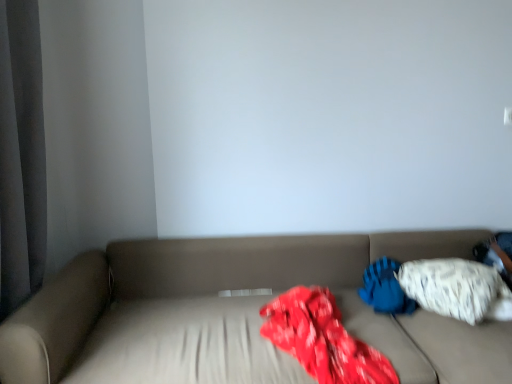
Measure the distance between point (x=75, y=328) and camera.

Point (x=75, y=328) is 1.70 meters from camera.

This screenshot has height=384, width=512. In order to click on white soft pillow at right, marked as the 2th pillow in a right-to-left arrangement in this screenshot , I will do `click(385, 288)`.

This screenshot has height=384, width=512. Identify the location of white textured pillow at right, placed as the first pillow when sorted from right to left. (457, 289).

Is white soft pillow at right, acting as the first pillow starting from the left, positioned with its back to white textured pillow at right, placed as the first pillow when sorted from right to left?

Yes, white textured pillow at right, placed as the first pillow when sorted from right to left, is at the back of white soft pillow at right, acting as the first pillow starting from the left.

Is white soft pillow at right, acting as the first pillow starting from the left, positioned far away from white textured pillow at right, placed as the second pillow when sorted from left to right?

Actually, white soft pillow at right, acting as the first pillow starting from the left, and white textured pillow at right, placed as the second pillow when sorted from left to right, are a little close together.

Which of these two, white soft pillow at right, marked as the 2th pillow in a right-to-left arrangement, or white textured pillow at right, placed as the second pillow when sorted from left to right, stands taller?

Standing taller between the two is white textured pillow at right, placed as the second pillow when sorted from left to right.

Is white textured pillow at right, placed as the first pillow when sorted from right to left, directly adjacent to beige fabric couch at center?

No, white textured pillow at right, placed as the first pillow when sorted from right to left, is not beside beige fabric couch at center.

Is white textured pillow at right, placed as the second pillow when sorted from left to right, facing away from beige fabric couch at center?

No, white textured pillow at right, placed as the second pillow when sorted from left to right, is not facing the opposite direction of beige fabric couch at center.

Considering the sizes of objects white textured pillow at right, placed as the first pillow when sorted from right to left, and beige fabric couch at center in the image provided, who is smaller, white textured pillow at right, placed as the first pillow when sorted from right to left, or beige fabric couch at center?

With smaller size is white textured pillow at right, placed as the first pillow when sorted from right to left.

From the picture: Considering the relative sizes of beige fabric couch at center and white soft pillow at right, marked as the 2th pillow in a right-to-left arrangement, in the image provided, is beige fabric couch at center smaller than white soft pillow at right, marked as the 2th pillow in a right-to-left arrangement,?

No, beige fabric couch at center is not smaller than white soft pillow at right, marked as the 2th pillow in a right-to-left arrangement.

Would you say beige fabric couch at center is outside white soft pillow at right, acting as the first pillow starting from the left?

Yes, beige fabric couch at center is outside of white soft pillow at right, acting as the first pillow starting from the left.

Which is farther from the camera, (55, 342) or (388, 266)?

The point (388, 266) is more distant.

Locate an element on the screen. The width and height of the screenshot is (512, 384). studio couch below the white textured pillow at right, placed as the first pillow when sorted from right to left (from the image's perspective) is located at coordinates (234, 313).

Between beige fabric couch at center and white textured pillow at right, placed as the first pillow when sorted from right to left, which one has larger size?

beige fabric couch at center.

Would you consider beige fabric couch at center to be distant from white textured pillow at right, placed as the second pillow when sorted from left to right?

No, beige fabric couch at center is in close proximity to white textured pillow at right, placed as the second pillow when sorted from left to right.

Which object is more forward, beige fabric couch at center or white textured pillow at right, placed as the first pillow when sorted from right to left?

Positioned in front is beige fabric couch at center.

Would you say white soft pillow at right, acting as the first pillow starting from the left, contains beige fabric couch at center?

No, beige fabric couch at center is not inside white soft pillow at right, acting as the first pillow starting from the left.

From the image's perspective, which is above, white soft pillow at right, marked as the 2th pillow in a right-to-left arrangement, or beige fabric couch at center?

white soft pillow at right, marked as the 2th pillow in a right-to-left arrangement, from the image's perspective.

In terms of width, does white soft pillow at right, acting as the first pillow starting from the left, look wider or thinner when compared to beige fabric couch at center?

Clearly, white soft pillow at right, acting as the first pillow starting from the left, has less width compared to beige fabric couch at center.

Who is bigger, white soft pillow at right, marked as the 2th pillow in a right-to-left arrangement, or beige fabric couch at center?

With larger size is beige fabric couch at center.

How much distance is there between white textured pillow at right, placed as the first pillow when sorted from right to left, and white soft pillow at right, acting as the first pillow starting from the left?

white textured pillow at right, placed as the first pillow when sorted from right to left, and white soft pillow at right, acting as the first pillow starting from the left, are 7.01 inches apart from each other.

Consider the image. Is white textured pillow at right, placed as the second pillow when sorted from left to right, positioned with its back to white soft pillow at right, acting as the first pillow starting from the left?

Absolutely, white textured pillow at right, placed as the second pillow when sorted from left to right, is directed away from white soft pillow at right, acting as the first pillow starting from the left.

Considering the points (414, 278) and (390, 259), which point is in front, point (414, 278) or point (390, 259)?

The point (414, 278) is closer.

Does white textured pillow at right, placed as the second pillow when sorted from left to right, have a lesser height compared to white soft pillow at right, marked as the 2th pillow in a right-to-left arrangement?

In fact, white textured pillow at right, placed as the second pillow when sorted from left to right, may be taller than white soft pillow at right, marked as the 2th pillow in a right-to-left arrangement.

This screenshot has width=512, height=384. I want to click on pillow below the white textured pillow at right, placed as the second pillow when sorted from left to right (from the image's perspective), so click(x=385, y=288).

From the image's perspective, count 2nd pillows upward from the beige fabric couch at center and point to it. Please provide its 2D coordinates.

[(457, 289)]

Looking at the image, which one is located further to white textured pillow at right, placed as the second pillow when sorted from left to right, beige fabric couch at center or white soft pillow at right, marked as the 2th pillow in a right-to-left arrangement?

beige fabric couch at center is further to white textured pillow at right, placed as the second pillow when sorted from left to right.

Based on their spatial positions, is white textured pillow at right, placed as the second pillow when sorted from left to right, or beige fabric couch at center closer to white soft pillow at right, marked as the 2th pillow in a right-to-left arrangement?

Among the two, white textured pillow at right, placed as the second pillow when sorted from left to right, is located nearer to white soft pillow at right, marked as the 2th pillow in a right-to-left arrangement.

Based on their spatial positions, is beige fabric couch at center or white textured pillow at right, placed as the second pillow when sorted from left to right, further from white soft pillow at right, marked as the 2th pillow in a right-to-left arrangement?

beige fabric couch at center is positioned further to the anchor white soft pillow at right, marked as the 2th pillow in a right-to-left arrangement.

Estimate the real-world distances between objects in this image. Which object is closer to white textured pillow at right, placed as the first pillow when sorted from right to left, white soft pillow at right, marked as the 2th pillow in a right-to-left arrangement, or beige fabric couch at center?

white soft pillow at right, marked as the 2th pillow in a right-to-left arrangement.

Estimate the real-world distances between objects in this image. Which object is further from beige fabric couch at center, white soft pillow at right, marked as the 2th pillow in a right-to-left arrangement, or white textured pillow at right, placed as the second pillow when sorted from left to right?

Based on the image, white soft pillow at right, marked as the 2th pillow in a right-to-left arrangement, appears to be further to beige fabric couch at center.

From the image, which object appears to be nearer to beige fabric couch at center, white textured pillow at right, placed as the first pillow when sorted from right to left, or white soft pillow at right, marked as the 2th pillow in a right-to-left arrangement?

Based on the image, white textured pillow at right, placed as the first pillow when sorted from right to left, appears to be nearer to beige fabric couch at center.

Image resolution: width=512 pixels, height=384 pixels. I want to click on pillow between beige fabric couch at center and white textured pillow at right, placed as the first pillow when sorted from right to left, so click(x=385, y=288).